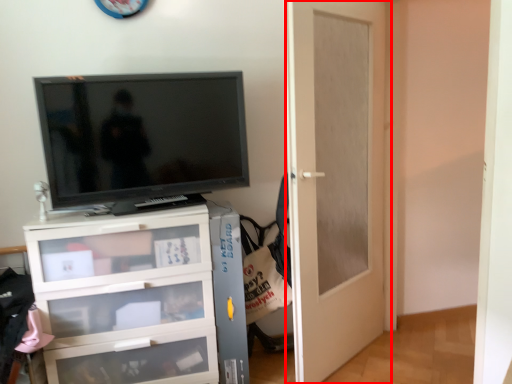
Question: From the image's perspective, what is the correct spatial relationship of door (annotated by the red box) in relation to television?

Choices:
 (A) above
 (B) below

Answer: (B)